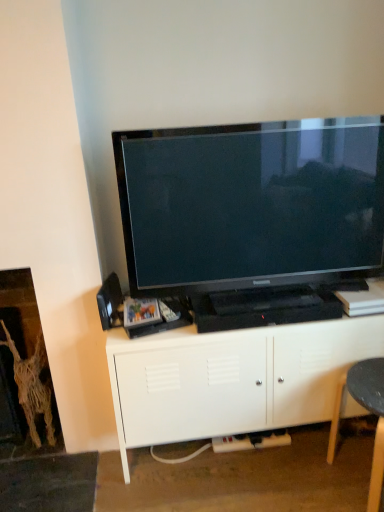
In order to click on black plastic swivel chair at lower right in this screenshot , I will do `click(369, 411)`.

What is the approximate height of black plastic plug at lower center?

black plastic plug at lower center is 1.17 inches tall.

At what (x,y) coordinates should I click in order to perform the action: click on black plastic plug at lower center. Please return your answer as a coordinate pair (x, y). Looking at the image, I should click on (251, 441).

This screenshot has height=512, width=384. In order to click on black plastic swivel chair at lower right in this screenshot , I will do `click(369, 411)`.

Would you say brown woven fireplace at left is outside white matte cabinet at center?

Indeed, brown woven fireplace at left is completely outside white matte cabinet at center.

Which is more to the left, brown woven fireplace at left or white matte cabinet at center?

Positioned to the left is brown woven fireplace at left.

I want to click on cabinetry on the right side of brown woven fireplace at left, so click(x=231, y=379).

Looking at their sizes, would you say brown woven fireplace at left is wider or thinner than white matte cabinet at center?

brown woven fireplace at left is thinner than white matte cabinet at center.

Based on the photo, how many degrees apart are the facing directions of black plastic plug at lower center and white matte cabinet at center?

They differ by 3.51 degrees in their facing directions.

Does black plastic plug at lower center turn towards white matte cabinet at center?

Yes, black plastic plug at lower center faces towards white matte cabinet at center.

Is black plastic plug at lower center at the left side of white matte cabinet at center?

Yes.

Between point (260, 438) and point (266, 415), which one is positioned in front?

The point (266, 415) is more forward.

Is white matte cabinet at center at the right side of matte black tv at center?

Yes.

Is white matte cabinet at center with matte black tv at center?

No, white matte cabinet at center is not making contact with matte black tv at center.

Is white matte cabinet at center not within matte black tv at center?

white matte cabinet at center lies outside matte black tv at center's area.

Image resolution: width=384 pixels, height=512 pixels. Find the location of `television on the left of white matte cabinet at center`. television on the left of white matte cabinet at center is located at coordinates (253, 217).

Does black plastic swivel chair at lower right have a lesser height compared to brown woven fireplace at left?

Yes.

From a real-world perspective, which object rests below the other?

In real-world perspective, black plastic swivel chair at lower right is lower.

Does black plastic swivel chair at lower right touch brown woven fireplace at left?

There is a gap between black plastic swivel chair at lower right and brown woven fireplace at left.

Is brown woven fireplace at left completely or partially inside black plastic swivel chair at lower right?

Definitely not — brown woven fireplace at left is not inside black plastic swivel chair at lower right.

From the image's perspective, which object appears higher, white matte cabinet at center or black plastic swivel chair at lower right?

white matte cabinet at center appears higher in the image.

This screenshot has height=512, width=384. In order to click on swivel chair on the right of white matte cabinet at center in this screenshot , I will do `click(369, 411)`.

Considering the positions of objects white matte cabinet at center and black plastic swivel chair at lower right in the image provided, who is in front, white matte cabinet at center or black plastic swivel chair at lower right?

black plastic swivel chair at lower right.

Consider the image. Who is taller, white matte cabinet at center or black plastic swivel chair at lower right?

white matte cabinet at center.

Identify the location of fireplace that is under the matte black tv at center (from a real-world perspective). tap(26, 365).

Considering the relative positions of brown woven fireplace at left and matte black tv at center in the image provided, is brown woven fireplace at left to the left of matte black tv at center from the viewer's perspective?

Correct, you'll find brown woven fireplace at left to the left of matte black tv at center.

Considering the sizes of objects brown woven fireplace at left and matte black tv at center in the image provided, who is wider, brown woven fireplace at left or matte black tv at center?

brown woven fireplace at left.

Identify the location of fireplace behind the white matte cabinet at center. This screenshot has width=384, height=512. (26, 365).

Can we say white matte cabinet at center lies outside brown woven fireplace at left?

white matte cabinet at center is positioned outside brown woven fireplace at left.

From a real-world perspective, is white matte cabinet at center physically located above or below brown woven fireplace at left?

white matte cabinet at center is situated lower than brown woven fireplace at left in the real world.

Is white matte cabinet at center to the left of brown woven fireplace at left from the viewer's perspective?

No, white matte cabinet at center is not to the left of brown woven fireplace at left.

The image size is (384, 512). Find the location of `cabinetry that appears in front of the brown woven fireplace at left`. cabinetry that appears in front of the brown woven fireplace at left is located at coordinates (231, 379).

Where is `plug lying behind the white matte cabinet at center`? plug lying behind the white matte cabinet at center is located at coordinates (251, 441).

From the image, which object appears to be farther from black plastic plug at lower center, brown woven fireplace at left or black plastic swivel chair at lower right?

Among the two, brown woven fireplace at left is located further to black plastic plug at lower center.

Which object lies nearer to the anchor point white matte cabinet at center, black plastic plug at lower center or matte black tv at center?

matte black tv at center is closer to white matte cabinet at center.

Based on their spatial positions, is brown woven fireplace at left or black plastic swivel chair at lower right further from white matte cabinet at center?

brown woven fireplace at left is positioned further to the anchor white matte cabinet at center.

Which object lies nearer to the anchor point white matte cabinet at center, black plastic plug at lower center or brown woven fireplace at left?

The object closer to white matte cabinet at center is black plastic plug at lower center.

Considering their positions, is black plastic swivel chair at lower right positioned closer to white matte cabinet at center than matte black tv at center?

black plastic swivel chair at lower right is positioned closer to the anchor white matte cabinet at center.

From the image, which object appears to be farther from brown woven fireplace at left, matte black tv at center or black plastic plug at lower center?

matte black tv at center lies further to brown woven fireplace at left than the other object.

From the image, which object appears to be nearer to brown woven fireplace at left, matte black tv at center or white matte cabinet at center?

Among the two, white matte cabinet at center is located nearer to brown woven fireplace at left.

Considering their positions, is white matte cabinet at center positioned closer to black plastic plug at lower center than black plastic swivel chair at lower right?

Among the two, white matte cabinet at center is located nearer to black plastic plug at lower center.

Where is `television between brown woven fireplace at left and black plastic swivel chair at lower right in the horizontal direction`? The width and height of the screenshot is (384, 512). television between brown woven fireplace at left and black plastic swivel chair at lower right in the horizontal direction is located at coordinates (253, 217).

I want to click on plug between brown woven fireplace at left and black plastic swivel chair at lower right in the horizontal direction, so click(x=251, y=441).

Locate an element on the screen. plug located between brown woven fireplace at left and matte black tv at center in the left-right direction is located at coordinates (251, 441).

The width and height of the screenshot is (384, 512). What are the coordinates of `cabinetry between black plastic swivel chair at lower right and black plastic plug at lower center along the z-axis` in the screenshot? It's located at (231, 379).